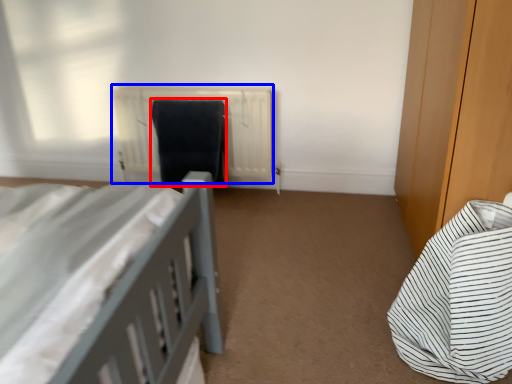
Question: Which object is further to the camera taking this photo, laundry (highlighted by a red box) or radiator (highlighted by a blue box)?

Choices:
 (A) laundry
 (B) radiator

Answer: (B)